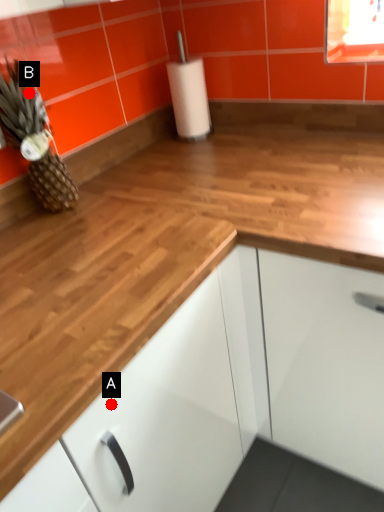
Question: Two points are circled on the image, labeled by A and B beside each circle. Which point is further to the camera?

Choices:
 (A) A is further
 (B) B is further

Answer: (B)